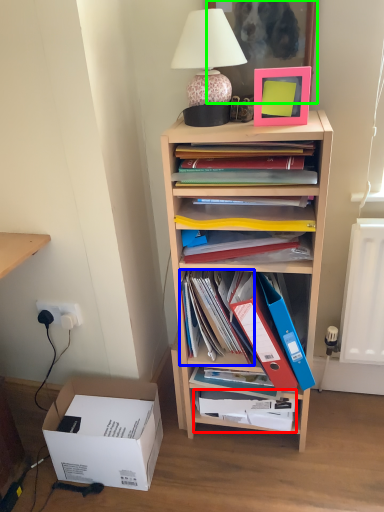
Question: Which is nearer to the book (highlighted by a red box)? book (highlighted by a blue box) or picture frame (highlighted by a green box).

Choices:
 (A) book
 (B) picture frame

Answer: (A)